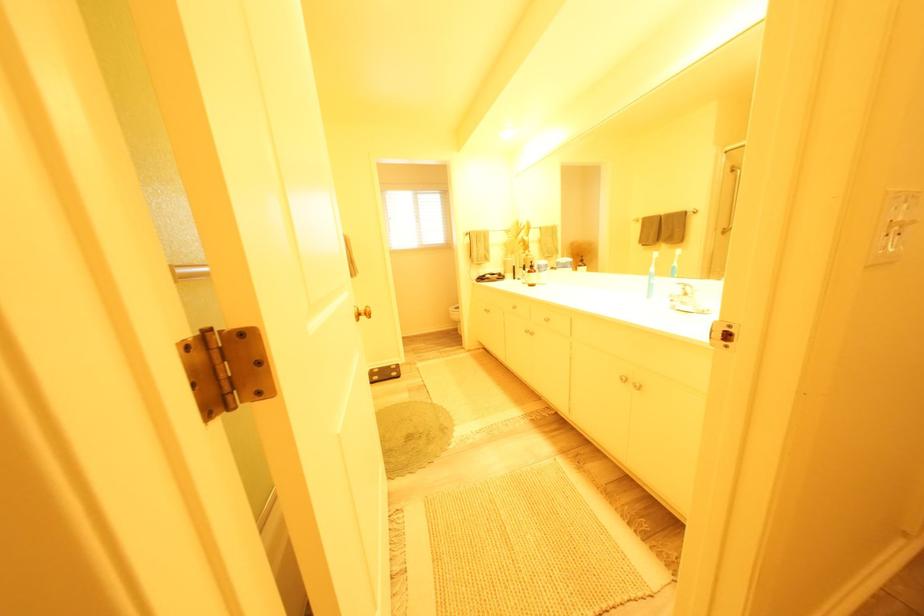
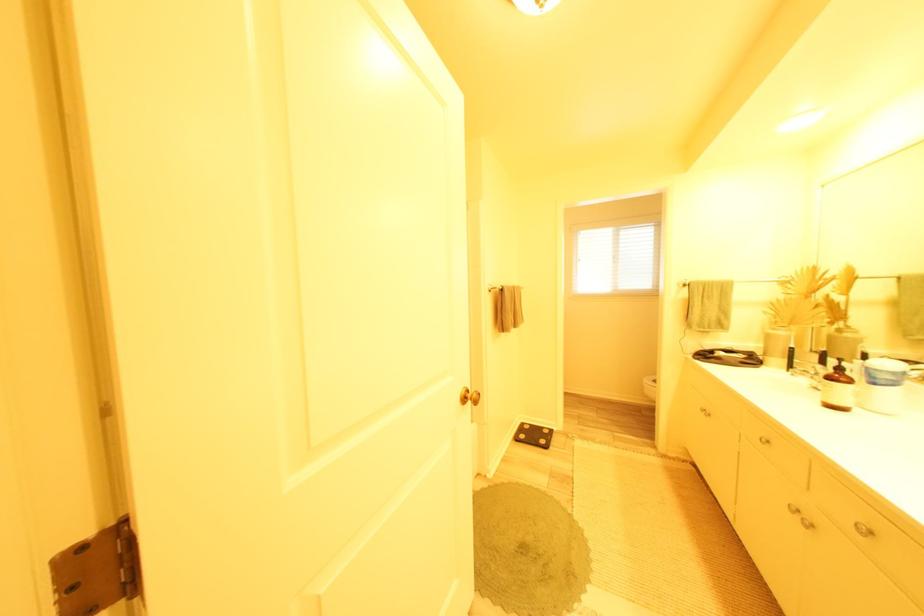
Where in the second image is the point corresponding to [386,379] from the first image?

(532, 438)